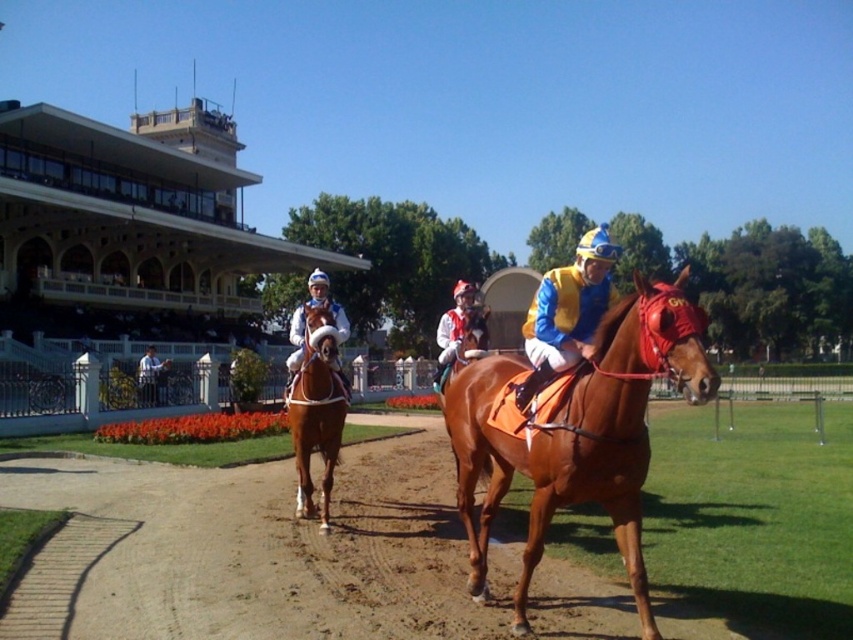
You are a photographer at the horse racing track. You need to capture a photo where the blue jersey at center and the white matte helmet at center are both visible. Based on their positions, which one should you focus on first to ensure both are in frame?

The blue jersey at center is located below the white matte helmet at center, so you should focus on the white matte helmet at center first to ensure both are in frame.